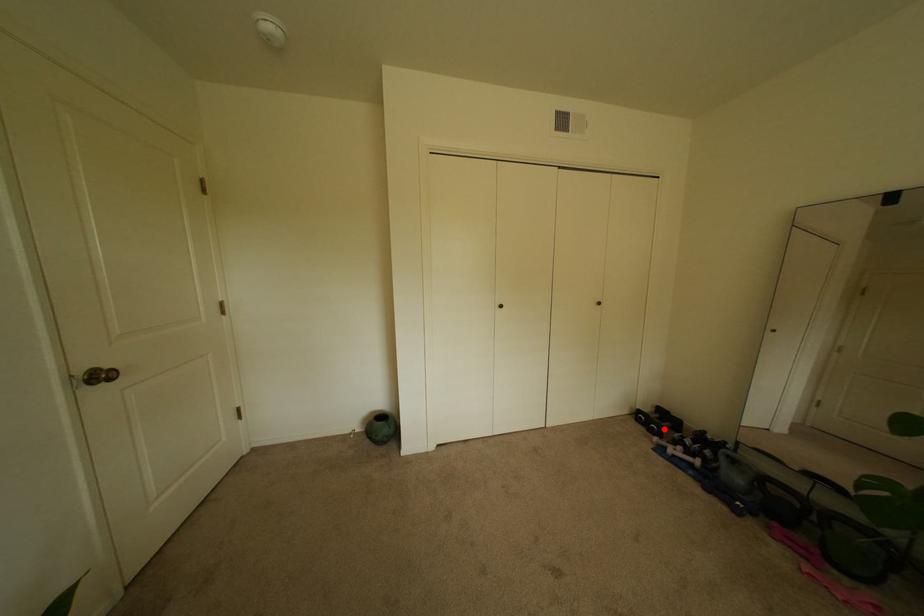
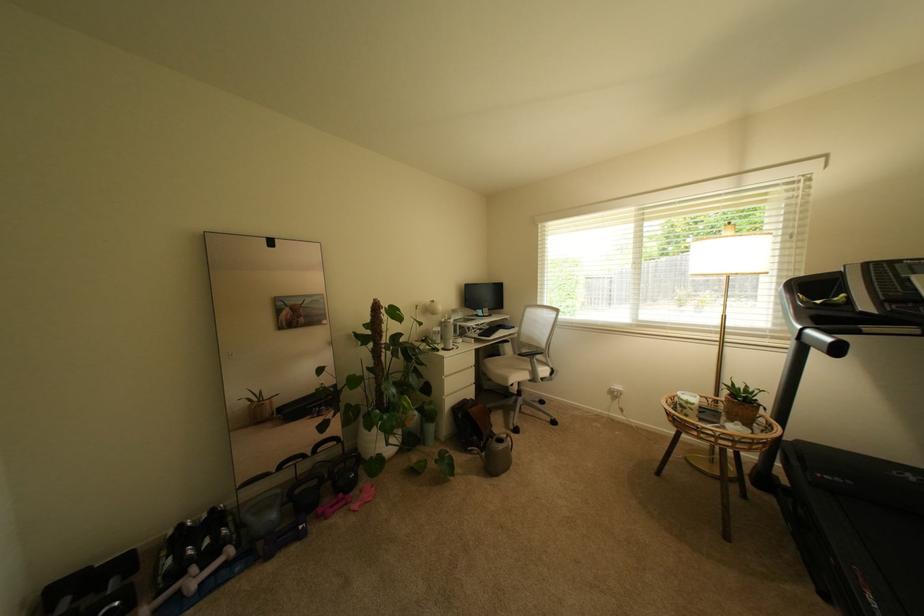
Where in the second image is the point corresponding to the highlighted location from the first image?

(126, 604)